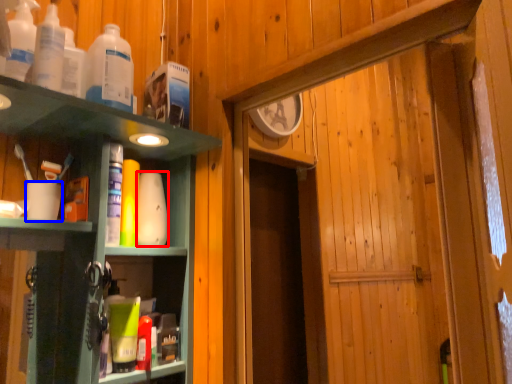
Question: Among these objects, which one is farthest to the camera, toiletry (highlighted by a red box) or coffee cup (highlighted by a blue box)?

Choices:
 (A) toiletry
 (B) coffee cup

Answer: (A)